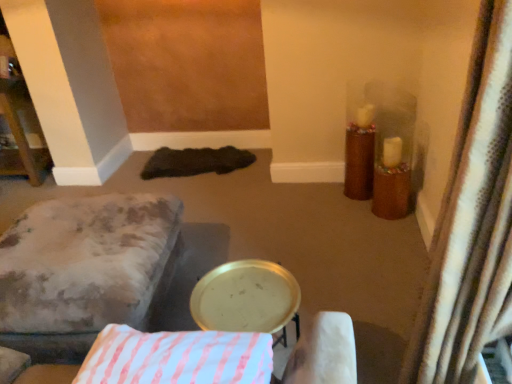
Question: Is velvet-like beige ottoman at lower left positioned far away from white textured curtain at right?

Choices:
 (A) no
 (B) yes

Answer: (B)

Question: Would you say velvet-like beige ottoman at lower left contains white textured curtain at right?

Choices:
 (A) no
 (B) yes

Answer: (A)

Question: Considering the relative sizes of velvet-like beige ottoman at lower left and white textured curtain at right in the image provided, is velvet-like beige ottoman at lower left smaller than white textured curtain at right?

Choices:
 (A) yes
 (B) no

Answer: (B)

Question: Is velvet-like beige ottoman at lower left next to white textured curtain at right?

Choices:
 (A) no
 (B) yes

Answer: (A)

Question: Considering the relative sizes of velvet-like beige ottoman at lower left and white textured curtain at right in the image provided, is velvet-like beige ottoman at lower left taller than white textured curtain at right?

Choices:
 (A) no
 (B) yes

Answer: (A)

Question: Can you confirm if velvet-like beige ottoman at lower left is shorter than white textured curtain at right?

Choices:
 (A) no
 (B) yes

Answer: (B)

Question: From the image's perspective, is gold metallic tray at center located above white striped fabric pillow at center?

Choices:
 (A) no
 (B) yes

Answer: (A)

Question: Is gold metallic tray at center oriented towards white striped fabric pillow at center?

Choices:
 (A) no
 (B) yes

Answer: (A)

Question: Is gold metallic tray at center taller than white striped fabric pillow at center?

Choices:
 (A) yes
 (B) no

Answer: (A)

Question: Is gold metallic tray at center behind white striped fabric pillow at center?

Choices:
 (A) yes
 (B) no

Answer: (A)

Question: Is gold metallic tray at center not within white striped fabric pillow at center?

Choices:
 (A) yes
 (B) no

Answer: (A)

Question: Is gold metallic tray at center bigger than white striped fabric pillow at center?

Choices:
 (A) yes
 (B) no

Answer: (A)

Question: Does velvet-like beige ottoman at lower left come in front of gold metallic tray at center?

Choices:
 (A) no
 (B) yes

Answer: (A)